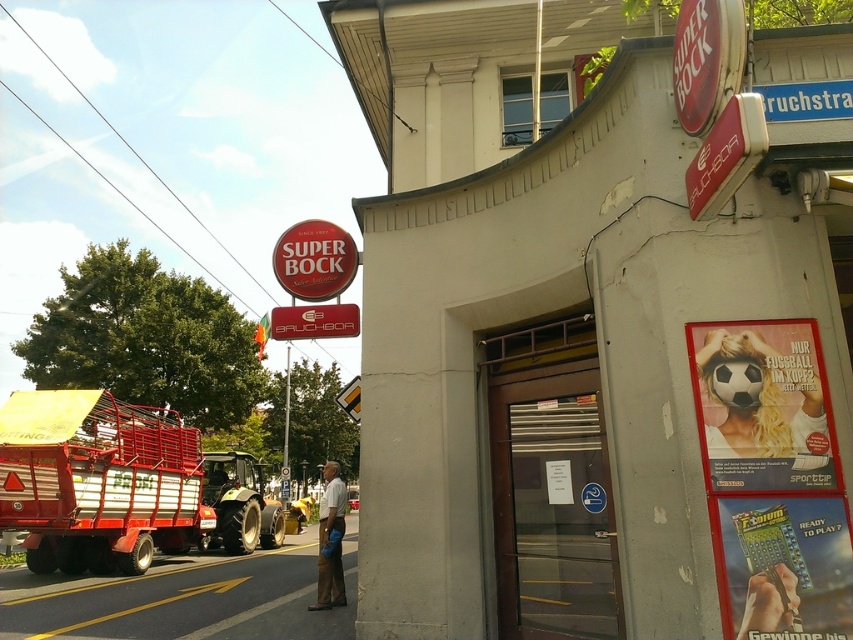
Question: Is metallic red trailer at left to the right of matte plastic poster at right from the viewer's perspective?

Choices:
 (A) no
 (B) yes

Answer: (A)

Question: Which of the following is the farthest from the observer?

Choices:
 (A) metallic silver phone at lower right
 (B) matte red sign at center

Answer: (B)

Question: Which of these objects is positioned closest to the metallic silver phone at lower right?

Choices:
 (A) matte red sign at center
 (B) metallic blue calculator at lower right

Answer: (B)

Question: Considering the real-world distances, which object is closest to the matte red sign at upper center?

Choices:
 (A) metallic blue calculator at lower right
 (B) metallic silver phone at lower right
 (C) light brown leather pants at center

Answer: (A)

Question: Is metallic silver phone at lower right positioned before matte red sign at center?

Choices:
 (A) no
 (B) yes

Answer: (B)

Question: Can you confirm if matte plastic poster at right is bigger than metallic silver phone at lower right?

Choices:
 (A) yes
 (B) no

Answer: (A)